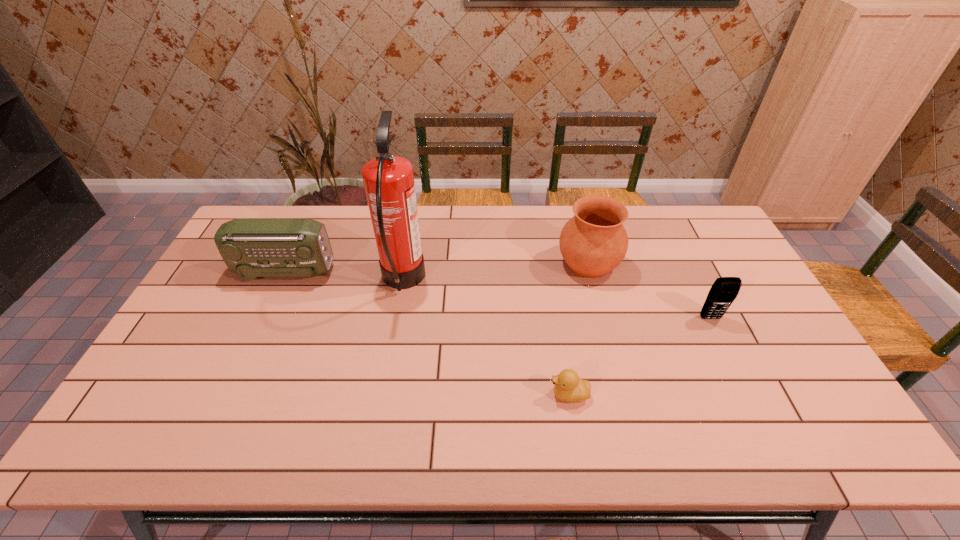
Find the location of a particular element. The width and height of the screenshot is (960, 540). blank area located 0.200m on the front-facing side of the leftmost object is located at coordinates (395, 272).

Identify the location of vacant space located on the screen of the fourth farthest object. This screenshot has height=540, width=960. (770, 438).

Locate an element on the screen. This screenshot has width=960, height=540. free space located facing forward on the duckling is located at coordinates (444, 395).

You are a GUI agent. You are given a task and a screenshot of the screen. Output one action in this format:
    pyautogui.click(x=<x>, y=<y>)
    Task: Click on the vacant point located facing forward on the duckling
    
    Given the screenshot: What is the action you would take?
    pyautogui.click(x=404, y=395)

Identify the location of vacant point located 0.210m facing forward on the duckling. The height and width of the screenshot is (540, 960). (465, 395).

The width and height of the screenshot is (960, 540). I want to click on object located at the far edge, so click(x=593, y=242).

Locate an element on the screen. This screenshot has height=540, width=960. object positioned at the left edge is located at coordinates (251, 247).

Identify the location of object that is positioned at the right edge. (724, 290).

In the image, there is a desktop. At what (x,y) coordinates should I click in order to perform the action: click on vacant space at the far edge. Please return your answer as a coordinate pair (x, y). Looking at the image, I should click on (552, 241).

Find the location of a particular element. This screenshot has width=960, height=540. vacant position at the near edge of the desktop is located at coordinates tap(537, 428).